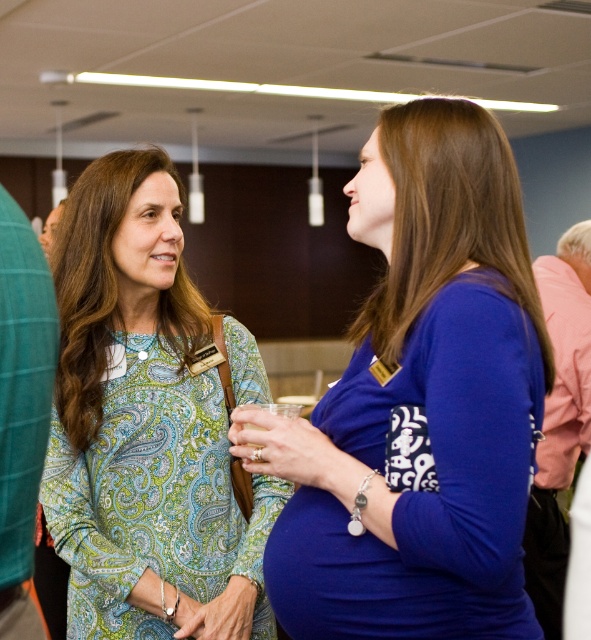
Which of these two, blue fabric dress at center or paisley-patterned blouse at center, stands shorter?

Standing shorter between the two is blue fabric dress at center.

Based on the photo, is the position of blue fabric dress at center less distant than that of paisley-patterned blouse at center?

Yes, blue fabric dress at center is in front of paisley-patterned blouse at center.

Which is behind, point (300, 486) or point (128, 346)?

Positioned behind is point (128, 346).

Identify the location of blue fabric dress at center. The height and width of the screenshot is (640, 591). (424, 408).